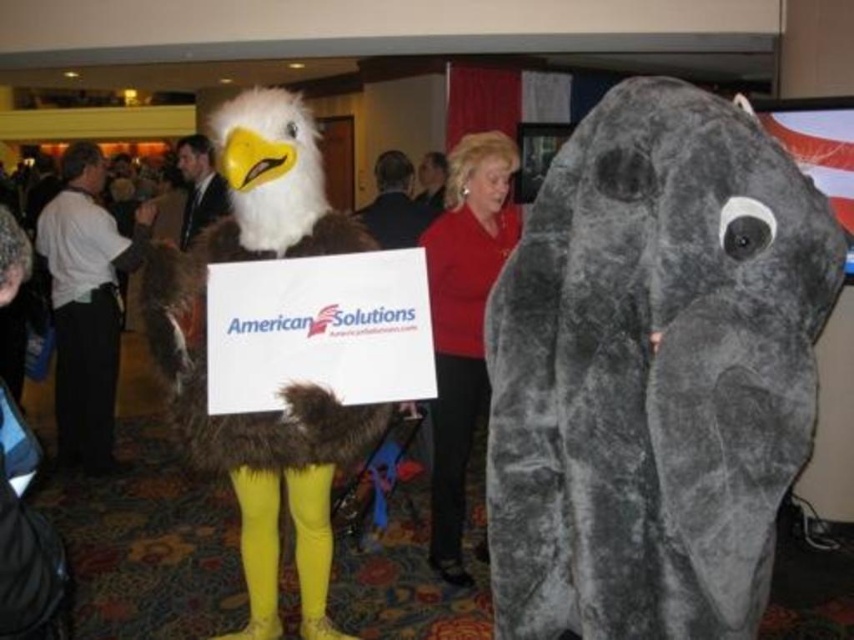
Does fuzzy brown eagle at center lie in front of smooth suit at center?

Yes, fuzzy brown eagle at center is closer to the viewer.

Between fuzzy brown eagle at center and smooth suit at center, which one is positioned higher?

Positioned higher is smooth suit at center.

Does point (249, 193) come farther from viewer compared to point (225, 192)?

No, it is in front of (225, 192).

I want to click on fuzzy brown eagle at center, so click(x=287, y=387).

The image size is (854, 640). Describe the element at coordinates (463, 321) in the screenshot. I see `red fabric at center` at that location.

Does point (466, 150) come farther from viewer compared to point (73, 172)?

That is False.

Identify the location of red fabric at center. Image resolution: width=854 pixels, height=640 pixels. (463, 321).

Image resolution: width=854 pixels, height=640 pixels. What do you see at coordinates (463, 321) in the screenshot?
I see `red fabric at center` at bounding box center [463, 321].

Does red fabric at center appear on the left side of smooth suit at center?

In fact, red fabric at center is to the right of smooth suit at center.

Which is in front, point (436, 353) or point (192, 218)?

Point (436, 353) is more forward.

At what (x,y) coordinates should I click in order to perform the action: click on red fabric at center. Please return your answer as a coordinate pair (x, y). Looking at the image, I should click on (463, 321).